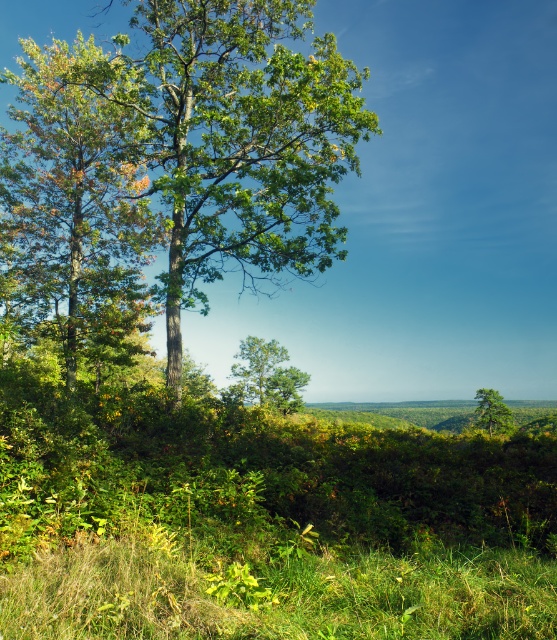
You are standing at the origin point of the coordinate system in this landscape. The green leafy tree at center is located at point (236, 140). If you walk directly towards the green leafy tree at center, will you encounter any obstacles between your starting position and the tree?

Result: The green leafy tree at center is located at point (236, 140). Since the path from the origin to this point is not mentioned to have any obstacles in the scene description, there are no obstacles between you and the tree.

You are standing in the middle of the grassy area and want to walk to both the point at coordinates (179,138) and the point at (81,241). Which point will you reach first?

You will reach the point at coordinates (179,138) first because it is closer to the viewer than the point at (81,241).